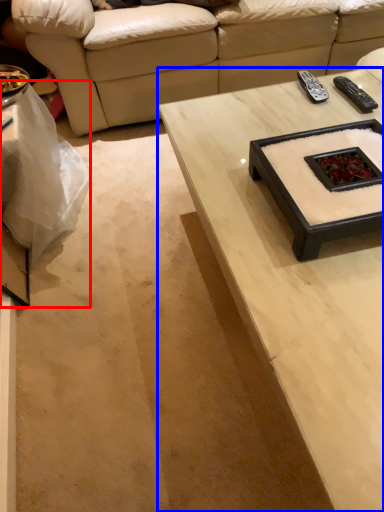
Question: Which object appears farthest to the camera in this image, table (highlighted by a red box) or coffee table (highlighted by a blue box)?

Choices:
 (A) table
 (B) coffee table

Answer: (A)